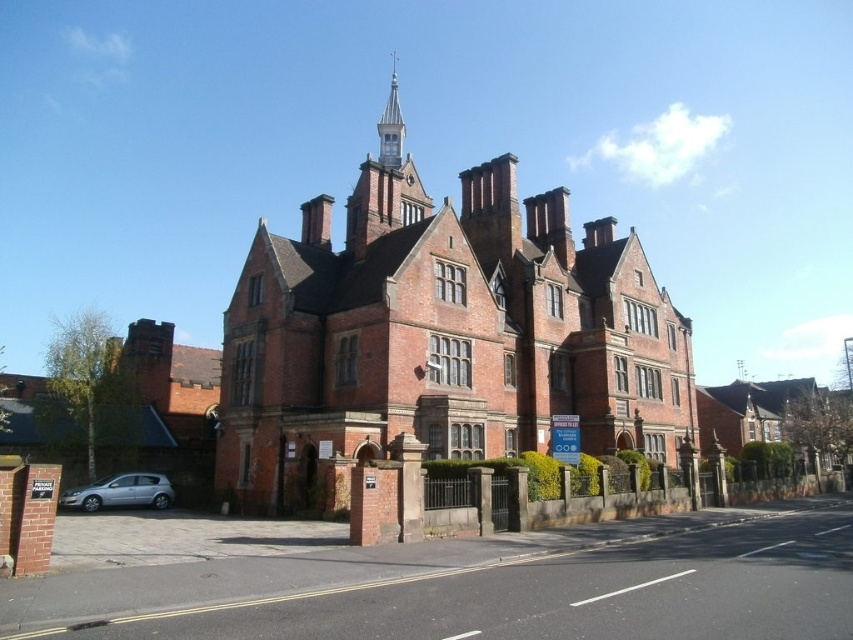
Question: Which point is farther to the camera?

Choices:
 (A) (144, 474)
 (B) (316, 202)

Answer: (B)

Question: In this image, where is silver metallic hatchback at lower left located relative to silver metallic spire at upper center?

Choices:
 (A) below
 (B) above

Answer: (A)

Question: Which point is farther to the camera?

Choices:
 (A) [x=328, y=490]
 (B) [x=103, y=497]

Answer: (B)

Question: Can you confirm if red brick church at center is positioned above silver metallic hatchback at lower left?

Choices:
 (A) yes
 (B) no

Answer: (A)

Question: Is red brick church at center thinner than silver metallic spire at upper center?

Choices:
 (A) yes
 (B) no

Answer: (B)

Question: Which point appears closest to the camera in this image?

Choices:
 (A) (80, 492)
 (B) (389, 136)

Answer: (A)